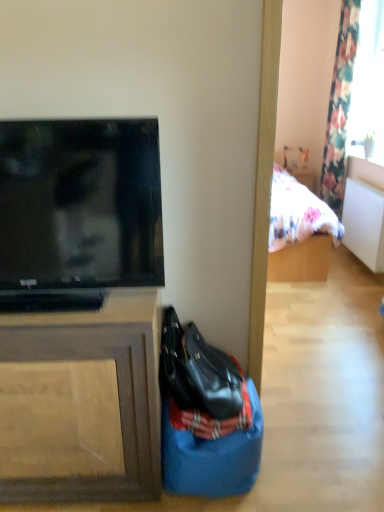
Question: Does transparent glass window at upper right lie in front of floral fabric curtain at upper right?

Choices:
 (A) no
 (B) yes

Answer: (B)

Question: Would you say floral fabric curtain at upper right is part of transparent glass window at upper right's contents?

Choices:
 (A) yes
 (B) no

Answer: (B)

Question: From a real-world perspective, is transparent glass window at upper right located beneath floral fabric curtain at upper right?

Choices:
 (A) no
 (B) yes

Answer: (A)

Question: Can you confirm if transparent glass window at upper right is smaller than floral fabric curtain at upper right?

Choices:
 (A) no
 (B) yes

Answer: (B)

Question: Is transparent glass window at upper right to the left of floral fabric curtain at upper right from the viewer's perspective?

Choices:
 (A) yes
 (B) no

Answer: (B)

Question: Does transparent glass window at upper right appear on the right side of floral fabric curtain at upper right?

Choices:
 (A) yes
 (B) no

Answer: (A)

Question: From a real-world perspective, is matte black television at left physically below floral fabric curtain at upper right?

Choices:
 (A) no
 (B) yes

Answer: (B)

Question: From the image's perspective, is matte black television at left beneath floral fabric curtain at upper right?

Choices:
 (A) yes
 (B) no

Answer: (A)

Question: From the image's perspective, is matte black television at left located above floral fabric curtain at upper right?

Choices:
 (A) yes
 (B) no

Answer: (B)

Question: Is matte black television at left to the right of floral fabric curtain at upper right from the viewer's perspective?

Choices:
 (A) yes
 (B) no

Answer: (B)

Question: Is matte black television at left surrounding floral fabric curtain at upper right?

Choices:
 (A) yes
 (B) no

Answer: (B)

Question: Is matte black television at left positioned in front of floral fabric curtain at upper right?

Choices:
 (A) yes
 (B) no

Answer: (A)

Question: Considering the relative sizes of brown wood cabinet at left and blue fabric sack at lower center in the image provided, is brown wood cabinet at left thinner than blue fabric sack at lower center?

Choices:
 (A) no
 (B) yes

Answer: (A)